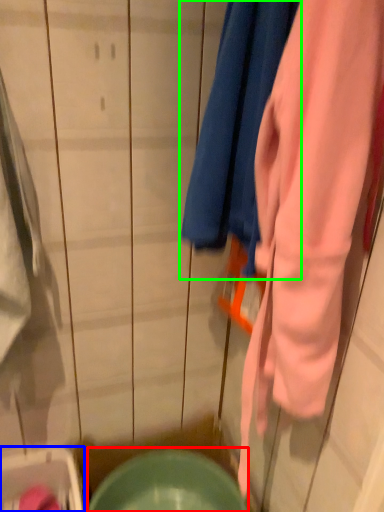
Question: Considering the real-world distances, which object is farthest from mixing bowl (highlighted by a red box)? washer (highlighted by a blue box) or towel (highlighted by a green box)?

Choices:
 (A) washer
 (B) towel

Answer: (B)